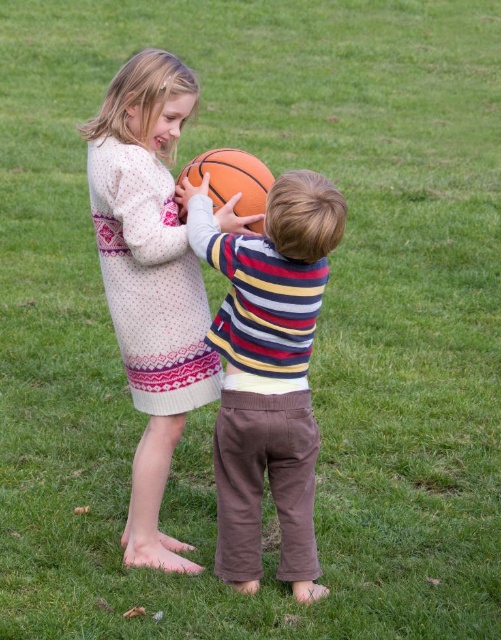
You are a photographer trying to capture a closeup of the orange textured basketball at center. You notice the matte striped sweater at center is blocking your view. Can you determine if the sweater is taller than the basketball?

The matte striped sweater at center has a greater height compared to the orange textured basketball at center, so yes, the sweater is taller and blocking the view.

You are a tailor who needs to determine which item is bigger between the matte striped sweater at center and the orange textured basketball at center. Which one is larger?

The matte striped sweater at center is larger than the orange textured basketball at center.

You are a parent who wants to put a knitted sweater at center and an orange textured basketball at center into a small bag that can only hold items up to 12 inches wide. Can both items fit if placed side by side?

The knitted sweater at center is wider than the orange textured basketball at center. Since the bag can only hold items up to 12 inches wide, and the sweater alone exceeds this width, placing both items side by side would not fit in the bag.